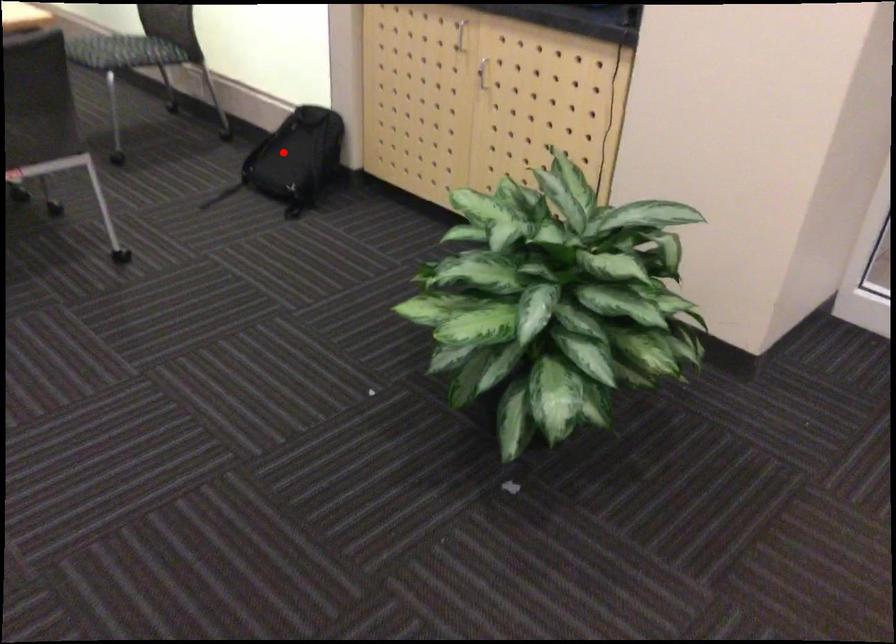
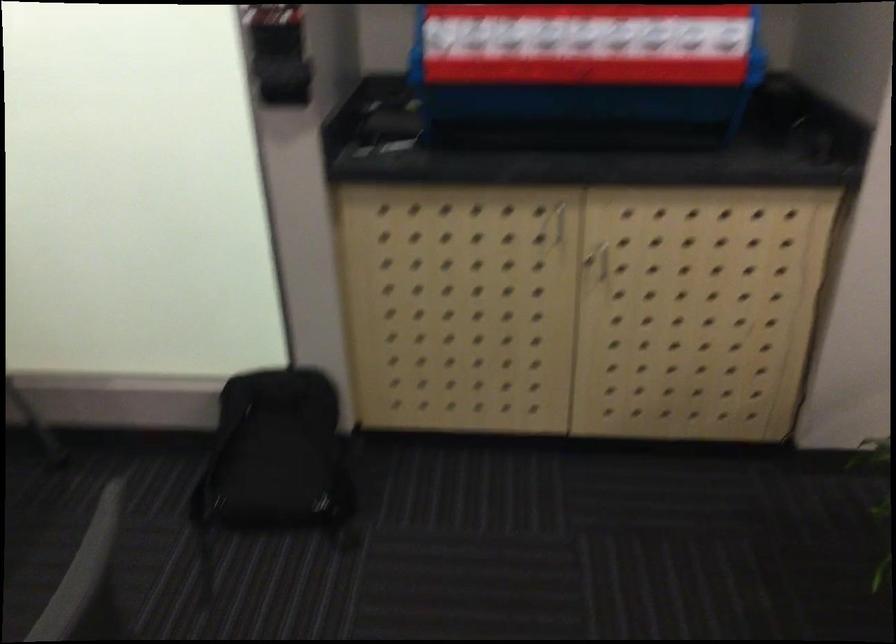
Question: I am providing you with two images of the same scene from different viewpoints. Given a red point in image1, look at the same physical point in image2. Is it:

Choices:
 (A) Closer to the viewpoint
 (B) Farther from the viewpoint

Answer: (A)